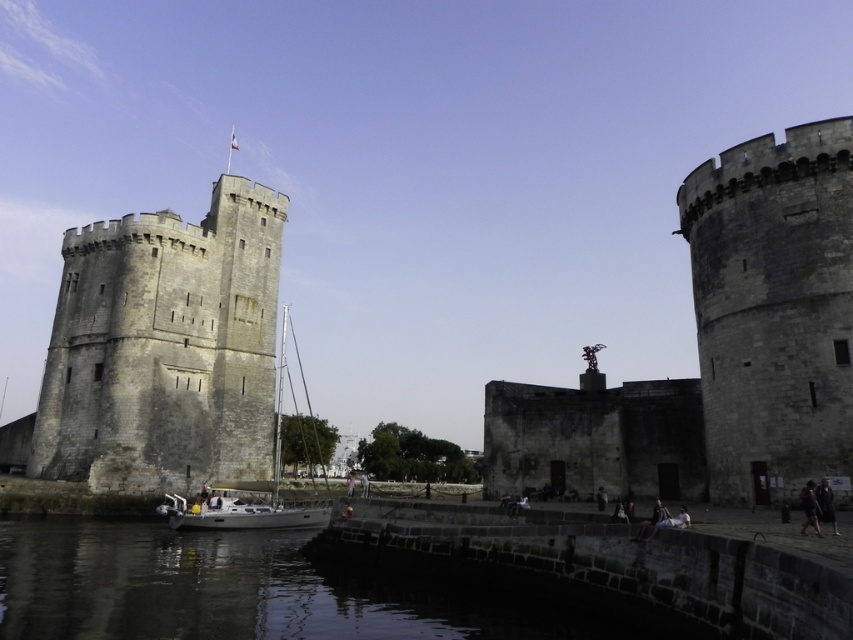
Question: Among these points, which one is nearest to the camera?

Choices:
 (A) (820, 504)
 (B) (260, 528)
 (C) (38, 611)
 (D) (770, 300)

Answer: (A)

Question: Which point is farther to the camera?

Choices:
 (A) (190, 365)
 (B) (397, 632)

Answer: (A)

Question: Which object is farther from the camera taking this photo?

Choices:
 (A) gray stone fort at center
 (B) black stone water at lower center
 (C) white matte sailboat at center

Answer: (C)

Question: Observing the image, what is the correct spatial positioning of dark brown leather jacket at lower right in reference to dark gray fabric jacket at lower right?

Choices:
 (A) below
 (B) above

Answer: (A)

Question: Can you confirm if gray stone fort at center is positioned to the right of gray stone tower at left?

Choices:
 (A) yes
 (B) no

Answer: (A)

Question: From the image, what is the correct spatial relationship of gray stone tower at left in relation to black stone water at lower center?

Choices:
 (A) right
 (B) left

Answer: (B)